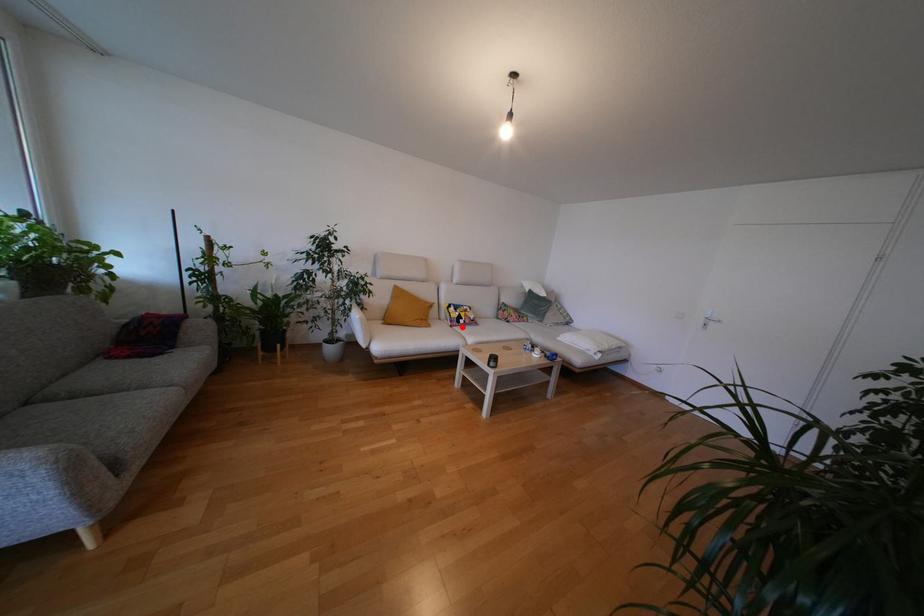
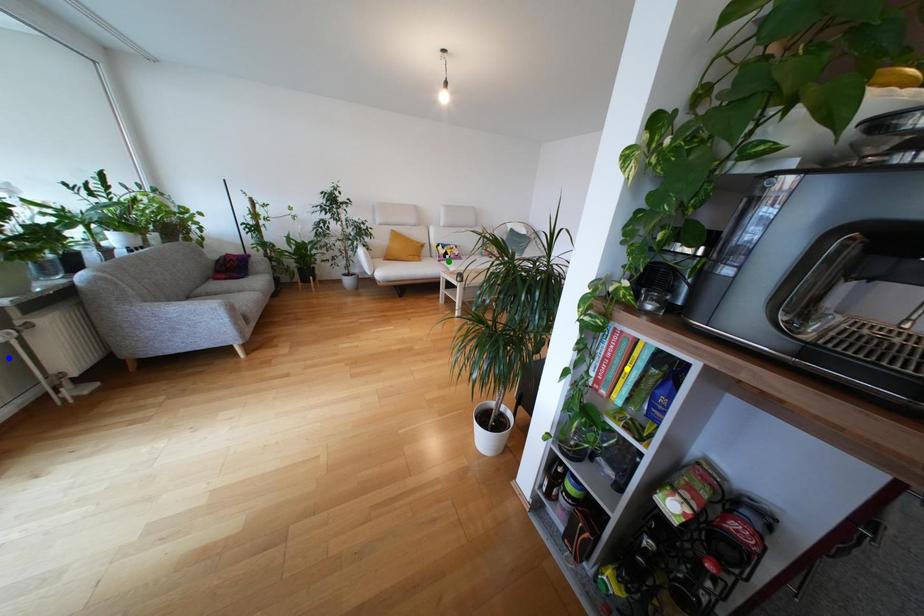
Question: I am providing you with two images of the same scene from different viewpoints. A red point is marked on the first image. You are given multiple points on the second image. Which mark in image 2 goes with the point in image 1?

Choices:
 (A) blue point
 (B) green point
 (C) yellow point

Answer: (B)